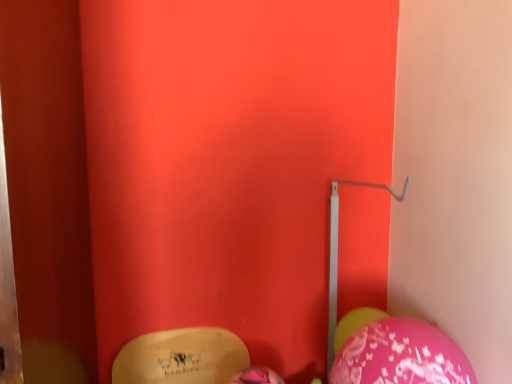
Question: Can you confirm if metallic silver trim at center-right is shorter than pink glossy balloon at lower right, which ranks as the first balloon in right-to-left order?

Choices:
 (A) no
 (B) yes

Answer: (A)

Question: From a real-world perspective, is metallic silver trim at center-right positioned over pink glossy balloon at lower right, positioned as the 2th balloon in front-to-back order, based on gravity?

Choices:
 (A) no
 (B) yes

Answer: (B)

Question: Does metallic silver trim at center-right have a lesser width compared to pink glossy balloon at lower right, acting as the 1th balloon starting from the back?

Choices:
 (A) no
 (B) yes

Answer: (A)

Question: From a real-world perspective, is metallic silver trim at center-right located beneath pink glossy balloon at lower right, which appears as the 2th balloon when viewed from the left?

Choices:
 (A) yes
 (B) no

Answer: (B)

Question: Is metallic silver trim at center-right positioned beyond the bounds of pink glossy balloon at lower right, acting as the 1th balloon starting from the back?

Choices:
 (A) yes
 (B) no

Answer: (A)

Question: Does metallic silver trim at center-right contain pink glossy balloon at lower right, which appears as the 2th balloon when viewed from the left?

Choices:
 (A) no
 (B) yes

Answer: (A)

Question: Considering the relative sizes of pink glossy balloon at lower right, acting as the 1th balloon starting from the back, and metallic silver trim at center-right in the image provided, is pink glossy balloon at lower right, acting as the 1th balloon starting from the back, wider than metallic silver trim at center-right?

Choices:
 (A) yes
 (B) no

Answer: (B)

Question: Is pink glossy balloon at lower right, which ranks as the first balloon in right-to-left order, positioned beyond the bounds of metallic silver trim at center-right?

Choices:
 (A) yes
 (B) no

Answer: (A)

Question: Is there a large distance between pink glossy balloon at lower right, which ranks as the first balloon in right-to-left order, and metallic silver trim at center-right?

Choices:
 (A) no
 (B) yes

Answer: (A)

Question: Is pink glossy balloon at lower right, positioned as the 2th balloon in front-to-back order, next to metallic silver trim at center-right?

Choices:
 (A) no
 (B) yes

Answer: (A)

Question: Is pink glossy balloon at lower right, positioned as the 2th balloon in front-to-back order, positioned with its back to metallic silver trim at center-right?

Choices:
 (A) no
 (B) yes

Answer: (A)

Question: Is pink glossy balloon at lower right, which ranks as the first balloon in right-to-left order, smaller than metallic silver trim at center-right?

Choices:
 (A) no
 (B) yes

Answer: (B)

Question: Is pink glossy balloon at lower right, the 1th balloon viewed from the front, wider than metallic silver trim at center-right?

Choices:
 (A) no
 (B) yes

Answer: (A)